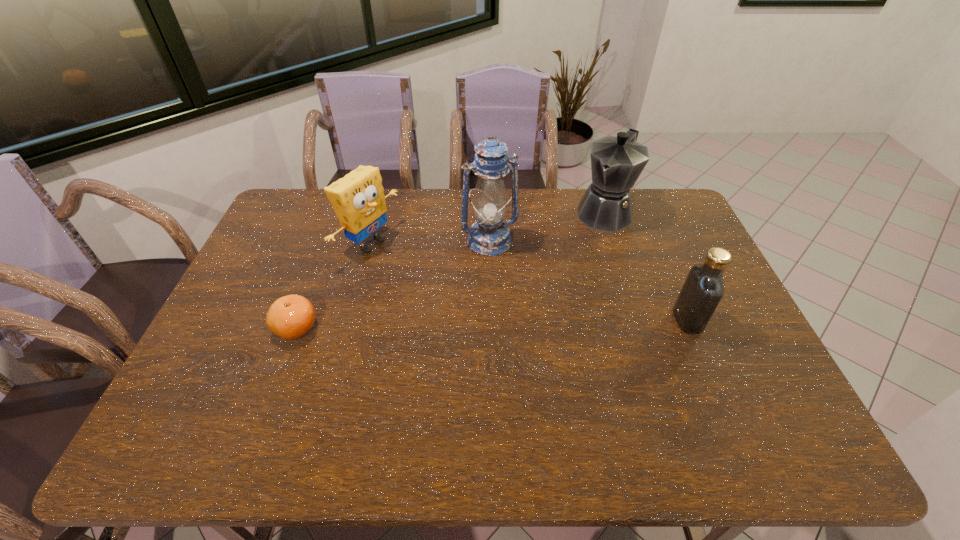
Where is `free space that satisfies the following two spatial constraints: 1. on the back side of the fourth shortest object; 2. on the left side of the tallest object`? free space that satisfies the following two spatial constraints: 1. on the back side of the fourth shortest object; 2. on the left side of the tallest object is located at coordinates (489, 212).

This screenshot has width=960, height=540. Find the location of `blank space that satisfies the following two spatial constraints: 1. on the back side of the sponge; 2. on the right side of the fourth object from left to right`. blank space that satisfies the following two spatial constraints: 1. on the back side of the sponge; 2. on the right side of the fourth object from left to right is located at coordinates (379, 212).

In order to click on vacant area in the image that satisfies the following two spatial constraints: 1. on the back side of the tallest object; 2. on the left side of the coffeepot in this screenshot , I will do `click(489, 212)`.